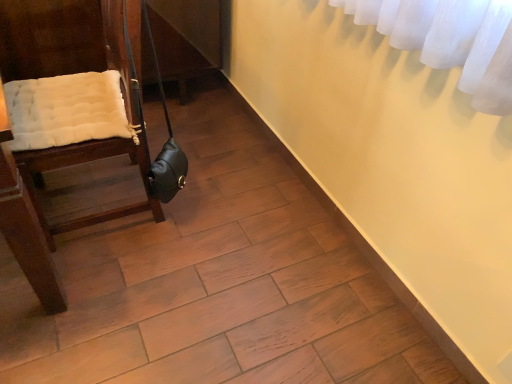
Identify the location of leather-like black bag at lower left. (165, 145).

The height and width of the screenshot is (384, 512). What do you see at coordinates (165, 145) in the screenshot? I see `leather-like black bag at lower left` at bounding box center [165, 145].

In the scene shown: Measure the distance between point (148, 21) and camera.

Point (148, 21) is 4.16 feet away from camera.

The image size is (512, 384). What do you see at coordinates (63, 40) in the screenshot?
I see `wooden chair with cushion at left` at bounding box center [63, 40].

Measure the distance between point (85, 54) and camera.

Point (85, 54) is 6.51 feet away from camera.

Locate an element on the screen. wooden chair with cushion at left is located at coordinates (63, 40).

Image resolution: width=512 pixels, height=384 pixels. I want to click on leather-like black bag at lower left, so click(165, 145).

Would you say wooden chair with cushion at left is to the left or to the right of leather-like black bag at lower left in the picture?

In the image, wooden chair with cushion at left appears on the left side of leather-like black bag at lower left.

Is wooden chair with cushion at left closer to camera compared to leather-like black bag at lower left?

Yes, wooden chair with cushion at left is closer to the viewer.

Considering the positions of point (144, 206) and point (164, 114), is point (144, 206) closer or farther from the camera than point (164, 114)?

Point (144, 206) appears to be closer to the viewer than point (164, 114).

From the image's perspective, which one is positioned lower, wooden chair with cushion at left or leather-like black bag at lower left?

leather-like black bag at lower left is shown below in the image.

From a real-world perspective, which is physically below, wooden chair with cushion at left or leather-like black bag at lower left?

wooden chair with cushion at left, from a real-world perspective.

Can you confirm if wooden chair with cushion at left is thinner than leather-like black bag at lower left?

Incorrect, the width of wooden chair with cushion at left is not less than that of leather-like black bag at lower left.

Considering the relative sizes of wooden chair with cushion at left and leather-like black bag at lower left in the image provided, is wooden chair with cushion at left shorter than leather-like black bag at lower left?

No.

Which of these two, wooden chair with cushion at left or leather-like black bag at lower left, is smaller?

Smaller between the two is leather-like black bag at lower left.

Can we say wooden chair with cushion at left lies outside leather-like black bag at lower left?

Absolutely, wooden chair with cushion at left is external to leather-like black bag at lower left.

From the picture: Are wooden chair with cushion at left and leather-like black bag at lower left far apart?

No.

Could you tell me if wooden chair with cushion at left is turned towards leather-like black bag at lower left?

No, wooden chair with cushion at left is not aimed at leather-like black bag at lower left.

Can you tell me how much wooden chair with cushion at left and leather-like black bag at lower left differ in facing direction?

180 degrees separate the facing orientations of wooden chair with cushion at left and leather-like black bag at lower left.

The width and height of the screenshot is (512, 384). Identify the location of furniture that appears on the left of leather-like black bag at lower left. (63, 40).

Which is more to the left, leather-like black bag at lower left or wooden chair with cushion at left?

wooden chair with cushion at left is more to the left.

Considering the relative positions of leather-like black bag at lower left and wooden chair with cushion at left in the image provided, is leather-like black bag at lower left in front of wooden chair with cushion at left?

No, leather-like black bag at lower left is further to the viewer.

Which is in front, point (170, 175) or point (101, 47)?

Positioned in front is point (170, 175).

From the image's perspective, which one is positioned higher, leather-like black bag at lower left or wooden chair with cushion at left?

wooden chair with cushion at left.

From a real-world perspective, which is physically above, leather-like black bag at lower left or wooden chair with cushion at left?

leather-like black bag at lower left is physically above.

Can you confirm if leather-like black bag at lower left is thinner than wooden chair with cushion at left?

Yes.

Who is taller, leather-like black bag at lower left or wooden chair with cushion at left?

Standing taller between the two is wooden chair with cushion at left.

In terms of size, does leather-like black bag at lower left appear bigger or smaller than wooden chair with cushion at left?

Clearly, leather-like black bag at lower left is smaller in size than wooden chair with cushion at left.

Would you say leather-like black bag at lower left contains wooden chair with cushion at left?

No, wooden chair with cushion at left is not surrounded by leather-like black bag at lower left.

Consider the image. Is leather-like black bag at lower left far from wooden chair with cushion at left?

Actually, leather-like black bag at lower left and wooden chair with cushion at left are a little close together.

Could you tell me if leather-like black bag at lower left is facing wooden chair with cushion at left?

Yes.

You are a GUI agent. You are given a task and a screenshot of the screen. Output one action in this format:
    pyautogui.click(x=<x>, y=<y>)
    Task: Click on the shoulder bag that is below the wooden chair with cushion at left (from the image's perspective)
    
    Given the screenshot: What is the action you would take?
    pyautogui.click(x=165, y=145)

The image size is (512, 384). Identify the location of shoulder bag positioned vertically above the wooden chair with cushion at left (from a real-world perspective). (165, 145).

This screenshot has height=384, width=512. Find the location of `shoulder bag lying behind the wooden chair with cushion at left`. shoulder bag lying behind the wooden chair with cushion at left is located at coordinates (165, 145).